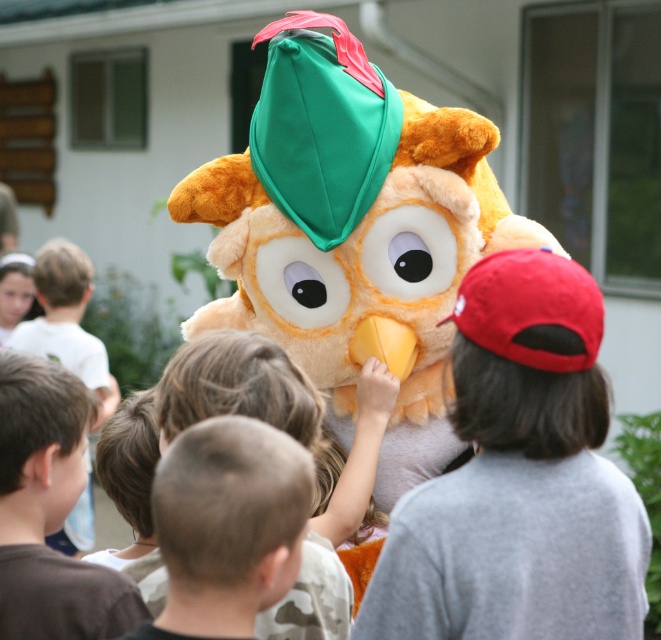
You are a photographer standing in front of the fluffy orange owl at center and the light brown hair at upper left. You need to capture a photo where both subjects are in focus. Which subject should you focus on first to ensure both are sharp?

The fluffy orange owl at center is taller than the light brown hair at upper left. You should focus on the fluffy orange owl at center first because it is larger and closer to the camera, ensuring both subjects will be in focus.

You are a photographer standing in front of the fluffy orange owl at center and the red fabric cap at center. You want to take a photo that captures both objects clearly. Which object should you focus on first to ensure both are in focus?

You should focus on the red fabric cap at center first because it is closer to you than the fluffy orange owl at center. By focusing on the closer object, the depth of field will naturally include the farther object in focus as well.

You are a photographer positioned at the back of the scene. You need to capture a photo where both the fluffy orange owl at center and the red fabric cap at center are visible. Considering their heights, which object will appear larger in the photo?

The fluffy orange owl at center is taller than the red fabric cap at center, so it will appear larger in the photo.